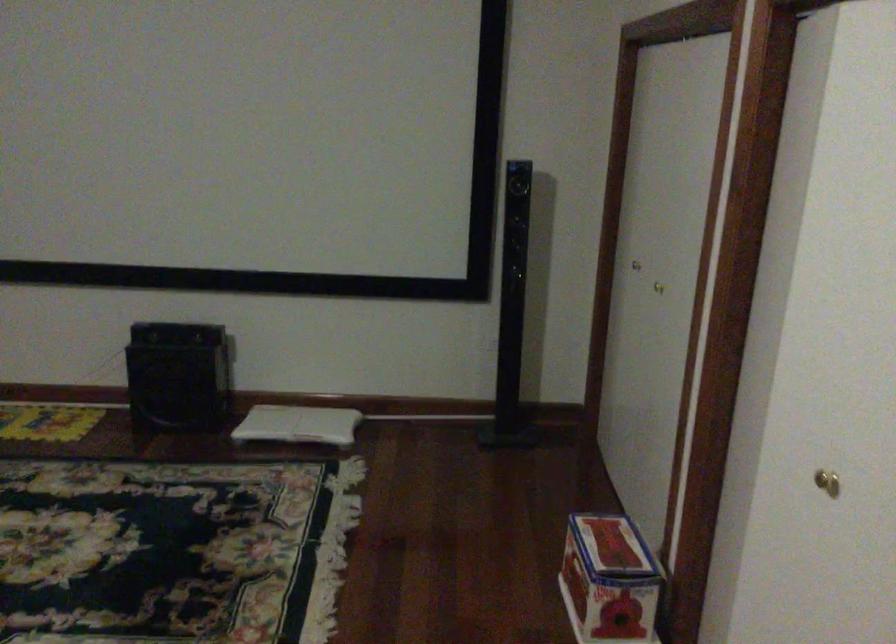
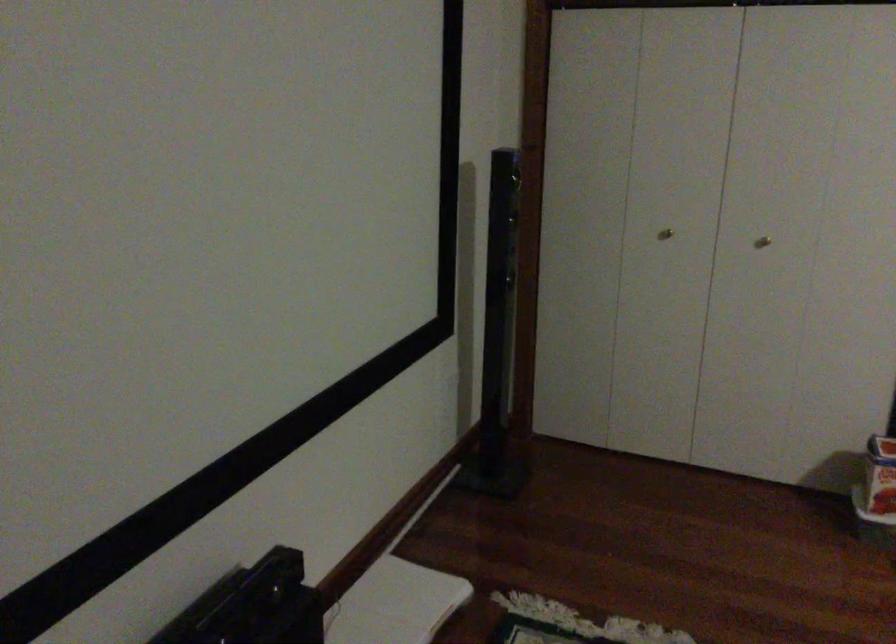
Where in the second image is the point corresponding to point (309, 422) from the first image?

(394, 603)